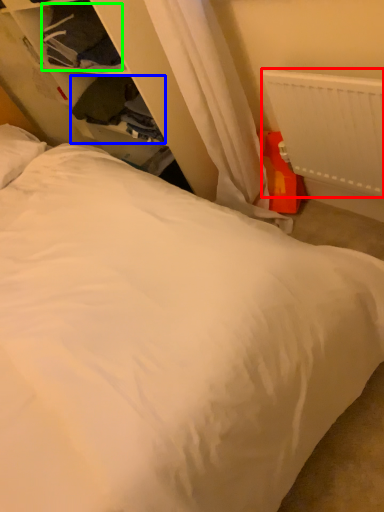
Question: Which object is positioned farthest from radiator (highlighted by a red box)? Select from clothing (highlighted by a blue box) and clothing (highlighted by a green box).

Choices:
 (A) clothing
 (B) clothing

Answer: (B)